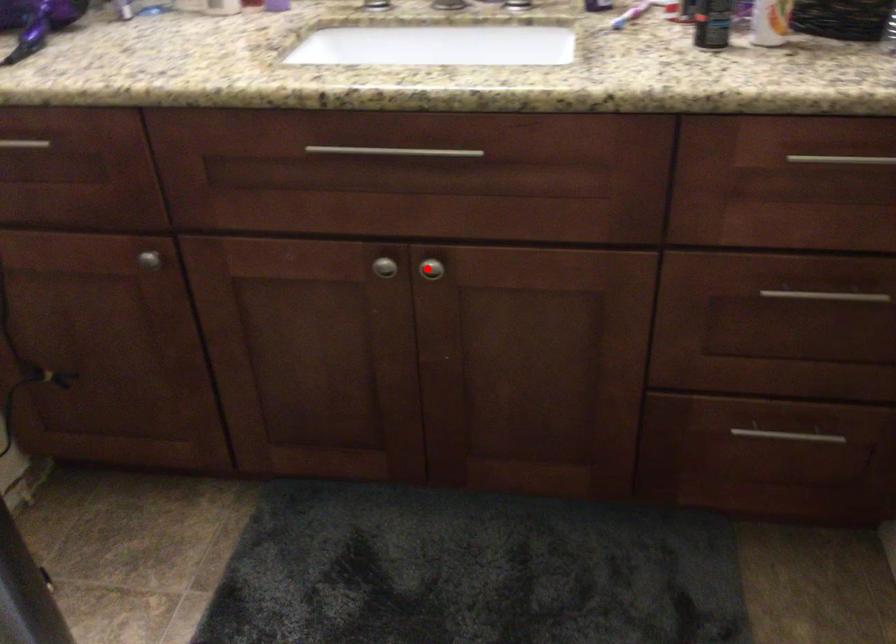
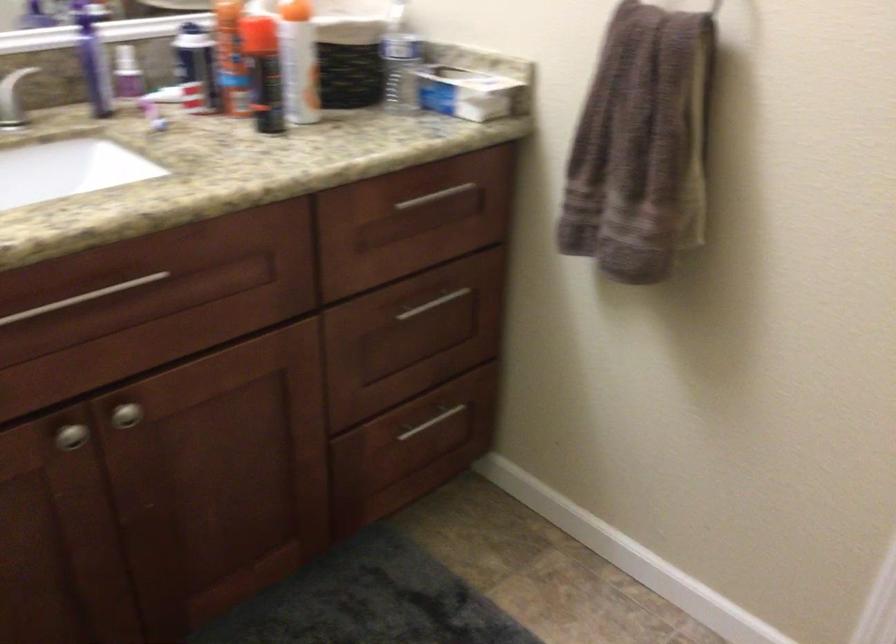
Question: I am providing you with two images of the same scene from different viewpoints. In image1, a red point is highlighted. Considering the same 3D point in image2, which of the following is correct?

Choices:
 (A) It is closer
 (B) It is farther

Answer: (A)